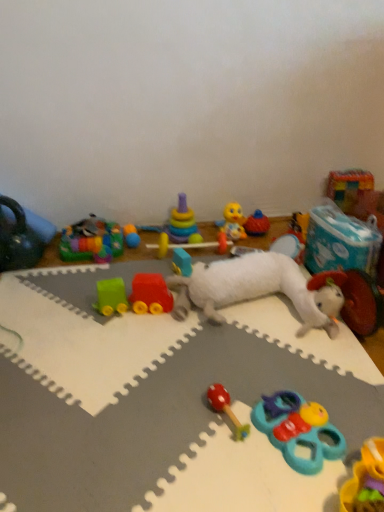
The width and height of the screenshot is (384, 512). I want to click on free space in front of smooth red wooden rattle at center, which ranks as the 7th toy in left-to-right order, so click(232, 474).